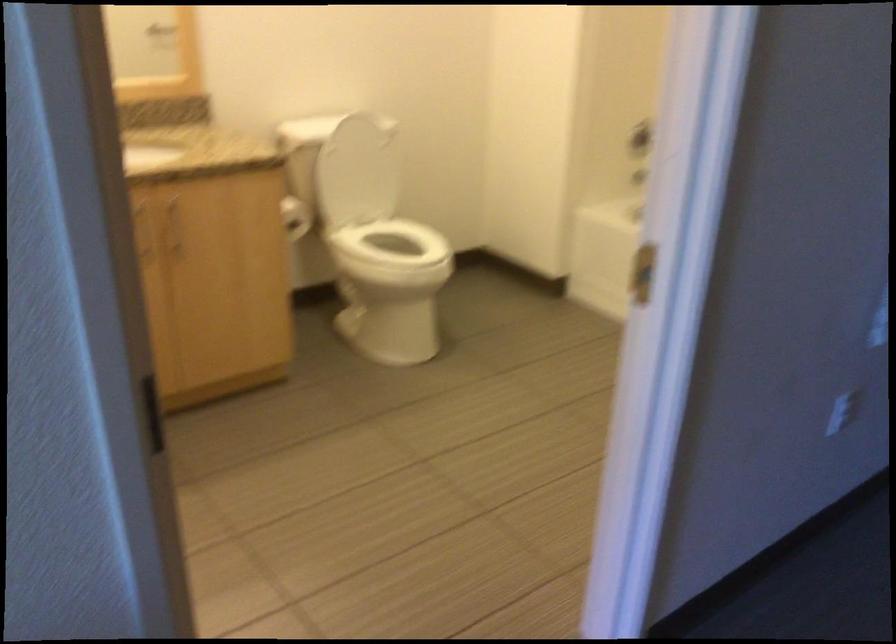
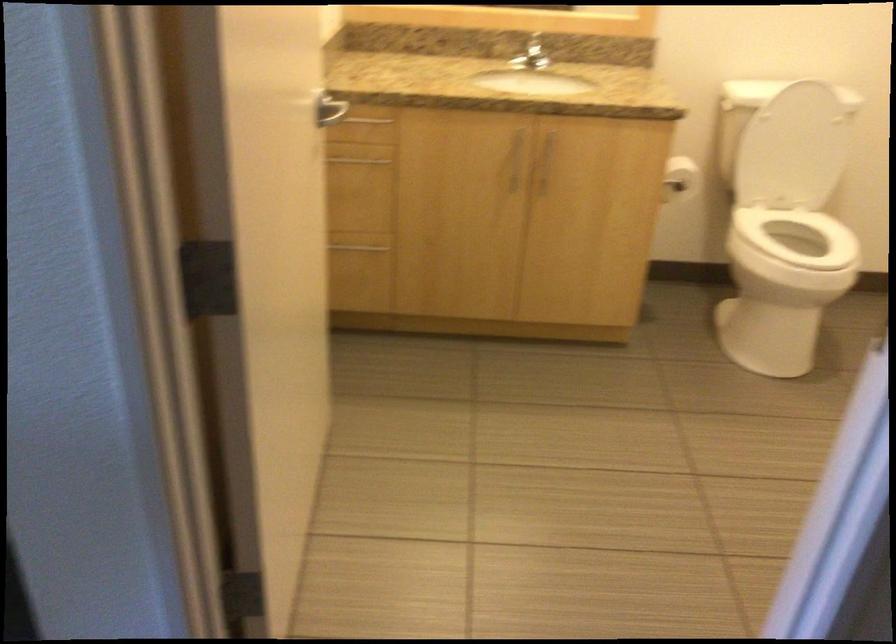
Question: The camera is either moving clockwise (left) or counter-clockwise (right) around the object. The first image is from the beginning of the video and the second image is from the end. Is the camera moving left or right when shooting the video?

Choices:
 (A) Left
 (B) Right

Answer: (B)